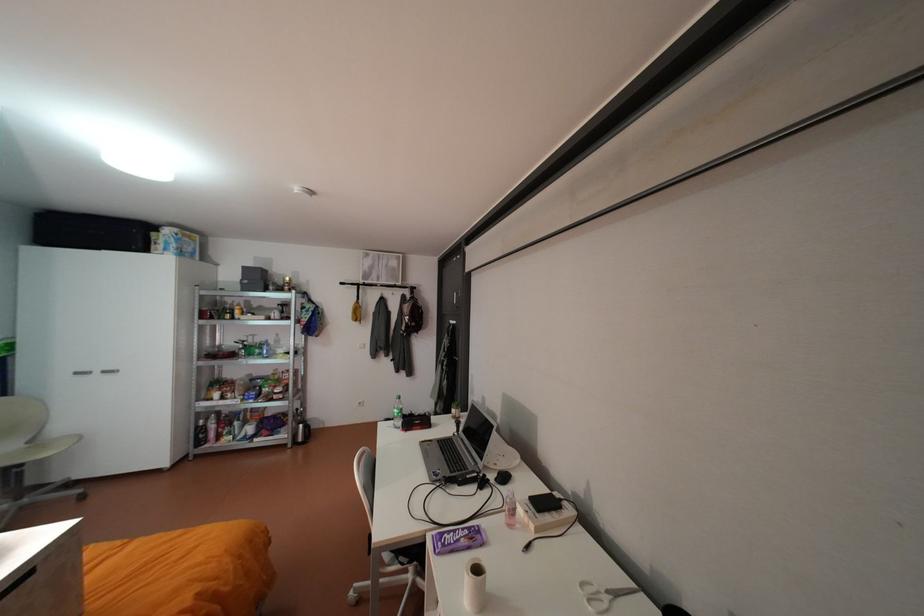
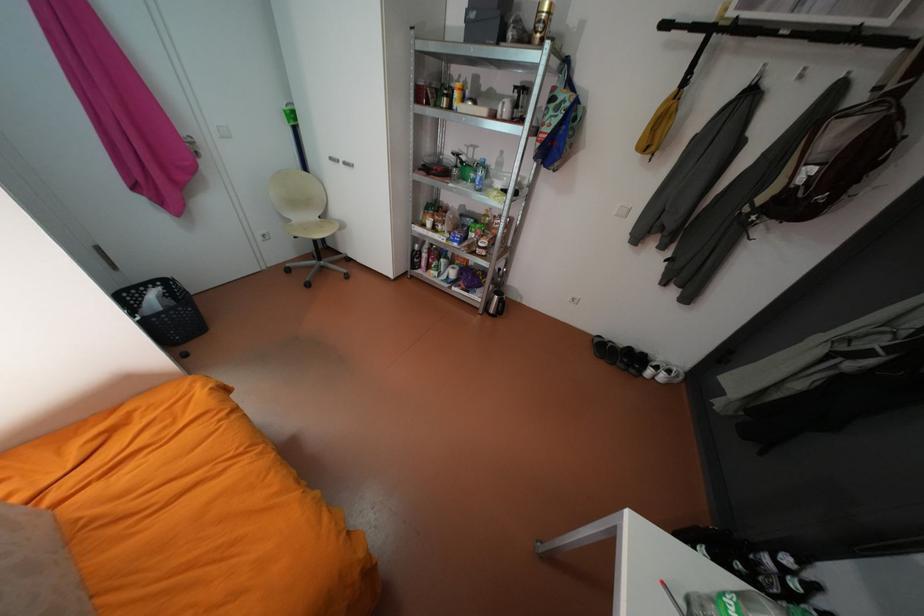
In the second image, find the point that corresponds to (x=361, y=283) in the first image.

(703, 26)